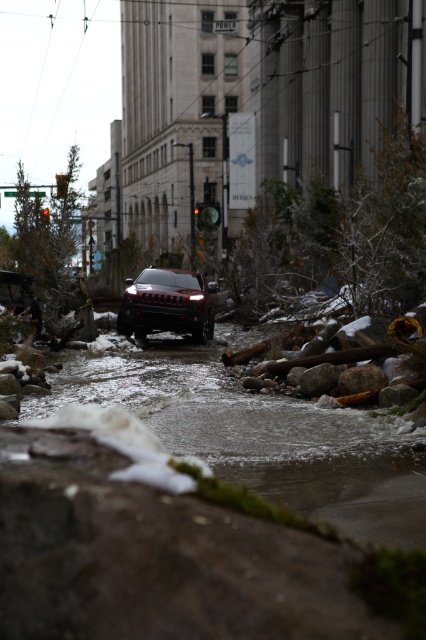
You are a delivery driver trying to reach a customer located at coordinates point 0.680, 0.606. Your vehicle has a maximum water depth it can safely traverse of 1 meter. The clear ice water at center is at point 0.606, 0.606. Can you safely reach the customer without risking your vehicle?

The clear ice water at center is at point [258,435]. Since the customer is located at coordinates point [258,435], which is exactly where the clear ice water at center is located, the water depth there may exceed your vehicle s safe limit. Therefore, it might not be safe to proceed directly to that location.

You are a driver trying to cross the flooded street in the image. You see the clear ice water at center and the shiny black suv at center. Which object takes up more space in the scene?

The clear ice water at center takes up more space in the scene than the shiny black suv at center, as it is described as bigger.

You are a rescue worker trying to reach a stranded vehicle in the flooded area. You see a point marked at coordinates (258, 435) indicating clear ice water at center. Is this point safe to cross?

The point at coordinates (258, 435) indicates clear ice water at center, which may pose a risk due to slippery conditions. Proceed with caution as ice can be hazardous underfoot or for vehicles.